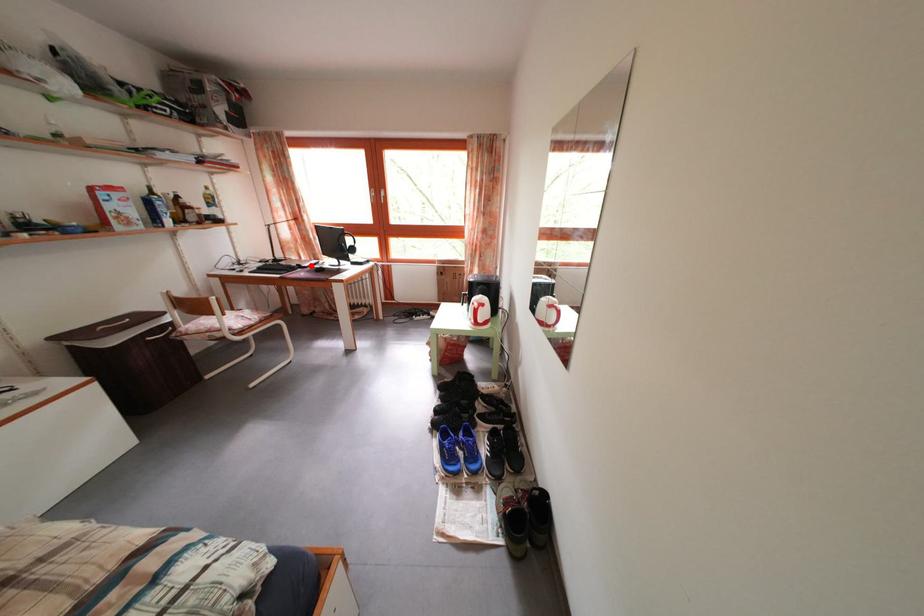
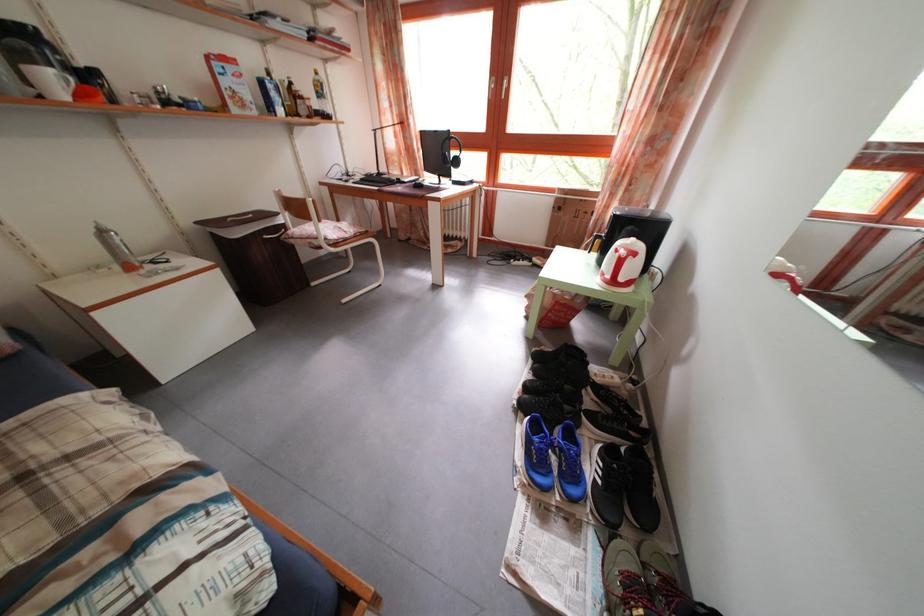
Question: I am providing you with two images of the same scene from different viewpoints. A red point is marked on the first image. At the location where the point appears in image 1, is it still visible in image 2?

Choices:
 (A) Yes
 (B) No

Answer: (A)